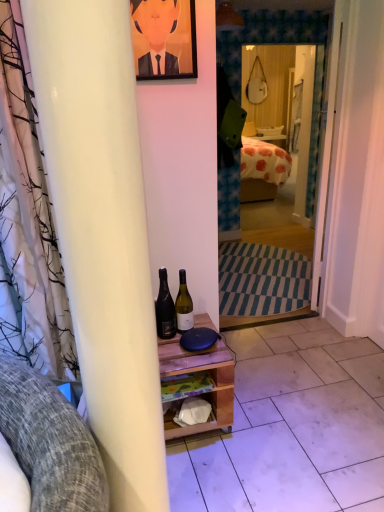
What do you see at coordinates (291, 426) in the screenshot? I see `wooden shelf at center, which is the first tile from left to right` at bounding box center [291, 426].

Consider the image. What is the approximate height of orange painted portrait at upper center?

It is 18.54 inches.

Image resolution: width=384 pixels, height=512 pixels. I want to click on matte white mirror at center, so click(283, 100).

What do you see at coordinates (328, 148) in the screenshot?
I see `white wooden door at center` at bounding box center [328, 148].

This screenshot has height=512, width=384. I want to click on wooden shelf at center, which is the first tile from left to right, so click(x=291, y=426).

Measure the distance from white matte bottle at center, the 2th bottle positioned from the left, to matte white mirror at center.

white matte bottle at center, the 2th bottle positioned from the left, is 15.59 feet away from matte white mirror at center.

Is white matte bottle at center, the 2th bottle positioned from the left, touching matte white mirror at center?

No, white matte bottle at center, the 2th bottle positioned from the left, is not next to matte white mirror at center.

From a real-world perspective, is white matte bottle at center, the 2th bottle positioned from the left, positioned under matte white mirror at center based on gravity?

Yes, from a real-world perspective, white matte bottle at center, the 2th bottle positioned from the left, is beneath matte white mirror at center.

Is the depth of white matte bottle at center, the 2th bottle positioned from the left, greater than that of matte white mirror at center?

No, it is not.

Which object is further away from the camera taking this photo, wooden shelf at center, arranged as the second tile when viewed from the right, or black glass bottle at center, the 1th bottle from the left?

Positioned behind is black glass bottle at center, the 1th bottle from the left.

Who is bigger, wooden shelf at center, which is the first tile from left to right, or black glass bottle at center, the 1th bottle from the left?

Bigger between the two is wooden shelf at center, which is the first tile from left to right.

Can you tell me how much wooden shelf at center, arranged as the second tile when viewed from the right, and black glass bottle at center, the 1th bottle from the left, differ in facing direction?

wooden shelf at center, arranged as the second tile when viewed from the right, and black glass bottle at center, the 1th bottle from the left, are facing 0.157 degrees away from each other.

The width and height of the screenshot is (384, 512). Find the location of `tile lying on the left of matte white mirror at center`. tile lying on the left of matte white mirror at center is located at coordinates (291, 426).

Would you consider matte white mirror at center to be distant from wooden shelf at center, arranged as the second tile when viewed from the right?

matte white mirror at center is far away from wooden shelf at center, arranged as the second tile when viewed from the right.

In the image, is matte white mirror at center positioned in front of or behind wooden shelf at center, which is the first tile from left to right?

matte white mirror at center is positioned farther from the viewer than wooden shelf at center, which is the first tile from left to right.

Is white tile at lower right, positioned as the second tile in left-to-right order, surrounded by orange painted portrait at upper center?

Actually, white tile at lower right, positioned as the second tile in left-to-right order, is outside orange painted portrait at upper center.

Would you say orange painted portrait at upper center is a long distance from white tile at lower right, positioned as the second tile in left-to-right order?

Yes.

Considering their positions, is orange painted portrait at upper center located in front of or behind white tile at lower right, which is the first tile from right to left?

orange painted portrait at upper center is in front of white tile at lower right, which is the first tile from right to left.

Can you tell me how much orange painted portrait at upper center and white tile at lower right, positioned as the second tile in left-to-right order, differ in facing direction?

They differ by 88.2 degrees in their facing directions.

Which is farther, [146,64] or [158,297]?

Positioned behind is point [158,297].

Can you tell me how much orange painted portrait at upper center and black glass bottle at center, which ranks as the second bottle in right-to-left order, differ in facing direction?

There is a 1.75-degree angle between the facing directions of orange painted portrait at upper center and black glass bottle at center, which ranks as the second bottle in right-to-left order.

Is orange painted portrait at upper center further to the viewer compared to black glass bottle at center, the 1th bottle from the left?

No.

Which of these two, orange painted portrait at upper center or black glass bottle at center, which ranks as the second bottle in right-to-left order, is thinner?

Thinner between the two is orange painted portrait at upper center.

Who is shorter, black glass bottle at center, which ranks as the second bottle in right-to-left order, or white matte bottle at center, the 2th bottle positioned from the left?

white matte bottle at center, the 2th bottle positioned from the left, is shorter.

The height and width of the screenshot is (512, 384). In order to click on bottle behind the black glass bottle at center, the 1th bottle from the left in this screenshot , I will do `click(184, 305)`.

From a real-world perspective, is black glass bottle at center, which ranks as the second bottle in right-to-left order, located higher than white matte bottle at center, the 1th bottle viewed from the right?

Yes, from a real-world perspective, black glass bottle at center, which ranks as the second bottle in right-to-left order, is on top of white matte bottle at center, the 1th bottle viewed from the right.

Is black glass bottle at center, the 1th bottle from the left, behind white matte bottle at center, the 2th bottle positioned from the left?

No, it is not.

Considering the positions of objects white tile at lower right, positioned as the second tile in left-to-right order, and black glass bottle at center, which ranks as the second bottle in right-to-left order, in the image provided, who is more to the right, white tile at lower right, positioned as the second tile in left-to-right order, or black glass bottle at center, which ranks as the second bottle in right-to-left order,?

white tile at lower right, positioned as the second tile in left-to-right order, is more to the right.

From a real-world perspective, is white tile at lower right, which is the first tile from right to left, over black glass bottle at center, the 1th bottle from the left?

No.

Between white tile at lower right, which is the first tile from right to left, and black glass bottle at center, which ranks as the second bottle in right-to-left order, which one has smaller width?

With smaller width is black glass bottle at center, which ranks as the second bottle in right-to-left order.

Is white tile at lower right, positioned as the second tile in left-to-right order, further to camera compared to black glass bottle at center, the 1th bottle from the left?

Yes, it is.

From a real-world perspective, which bottle is the 2nd one underneath the matte white mirror at center? Please provide its 2D coordinates.

[(184, 305)]

This screenshot has width=384, height=512. I want to click on the 1st bottle above when counting from the wooden shelf at center, which is the first tile from left to right (from the image's perspective), so click(165, 308).

From the picture: When comparing their distances from orange painted portrait at upper center, does white tile at lower right, which is the first tile from right to left, or white matte bottle at center, the 2th bottle positioned from the left, seem closer?

white matte bottle at center, the 2th bottle positioned from the left, is positioned closer to the anchor orange painted portrait at upper center.

Estimate the real-world distances between objects in this image. Which object is closer to white tile at lower right, which is the first tile from right to left, matte white mirror at center or wooden shelf at center, arranged as the second tile when viewed from the right?

Based on the image, wooden shelf at center, arranged as the second tile when viewed from the right, appears to be nearer to white tile at lower right, which is the first tile from right to left.

When comparing their distances from black glass bottle at center, the 1th bottle from the left, does wooden shelf at center, arranged as the second tile when viewed from the right, or matte white mirror at center seem further?

matte white mirror at center.

Considering their positions, is matte white mirror at center positioned closer to white wooden door at center than orange painted portrait at upper center?

Based on the image, orange painted portrait at upper center appears to be nearer to white wooden door at center.

From the image, which object appears to be farther from wooden shelf at center, arranged as the second tile when viewed from the right, white tile at lower right, which is the first tile from right to left, or black glass bottle at center, which ranks as the second bottle in right-to-left order?

The object further to wooden shelf at center, arranged as the second tile when viewed from the right, is black glass bottle at center, which ranks as the second bottle in right-to-left order.

Estimate the real-world distances between objects in this image. Which object is closer to matte white mirror at center, black glass bottle at center, the 1th bottle from the left, or wooden shelf at center, which is the first tile from left to right?

wooden shelf at center, which is the first tile from left to right, is positioned closer to the anchor matte white mirror at center.

When comparing their distances from white tile at lower right, which is the first tile from right to left, does matte white mirror at center or black glass bottle at center, the 1th bottle from the left, seem closer?

black glass bottle at center, the 1th bottle from the left, lies closer to white tile at lower right, which is the first tile from right to left, than the other object.

Considering their positions, is white wooden door at center positioned further to white tile at lower right, which is the first tile from right to left, than white matte bottle at center, the 1th bottle viewed from the right?

Based on the image, white matte bottle at center, the 1th bottle viewed from the right, appears to be further to white tile at lower right, which is the first tile from right to left.

This screenshot has width=384, height=512. In order to click on bottle between white matte bottle at center, the 2th bottle positioned from the left, and wooden shelf at center, arranged as the second tile when viewed from the right, in the vertical direction in this screenshot , I will do `click(165, 308)`.

The width and height of the screenshot is (384, 512). In order to click on door between white matte bottle at center, the 2th bottle positioned from the left, and matte white mirror at center, along the z-axis in this screenshot , I will do pyautogui.click(x=328, y=148).

The image size is (384, 512). I want to click on bottle between orange painted portrait at upper center and black glass bottle at center, which ranks as the second bottle in right-to-left order, in the vertical direction, so (184, 305).

This screenshot has width=384, height=512. I want to click on door positioned between orange painted portrait at upper center and matte white mirror at center from near to far, so click(328, 148).